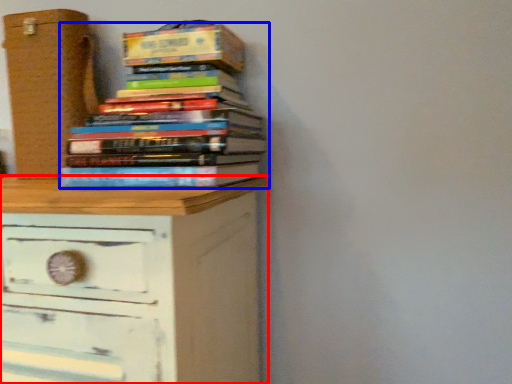
Question: Which of the following is the closest to the observer, chest of drawers (highlighted by a red box) or book (highlighted by a blue box)?

Choices:
 (A) chest of drawers
 (B) book

Answer: (A)